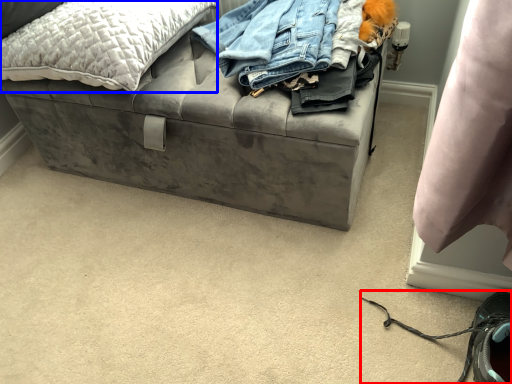
Question: Which point is further to the camera, shoe (highlighted by a red box) or pillow (highlighted by a blue box)?

Choices:
 (A) shoe
 (B) pillow

Answer: (B)